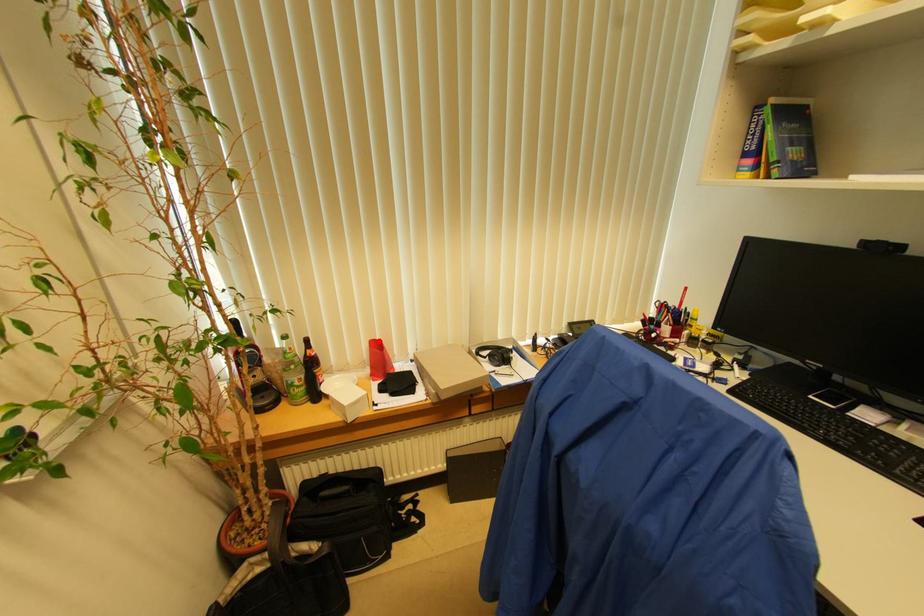
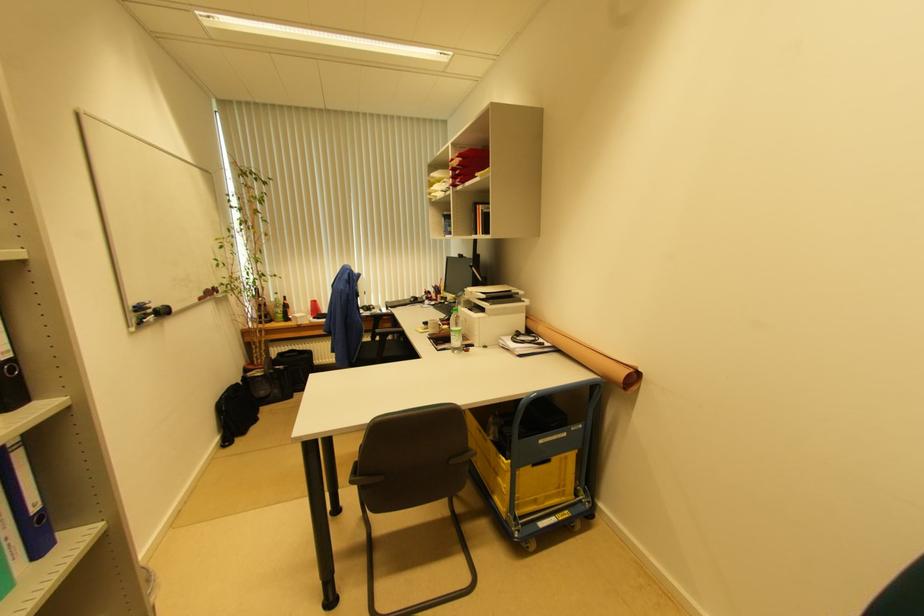
The point at the highlighted location is marked in the first image. Where is the corresponding point in the second image?

(315, 302)